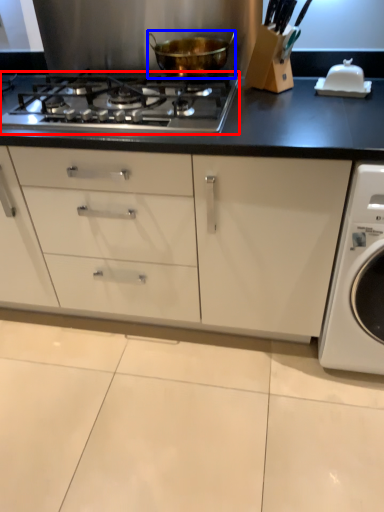
Question: Which object is closer to the camera taking this photo, gas stove (highlighted by a red box) or kitchen appliance (highlighted by a blue box)?

Choices:
 (A) gas stove
 (B) kitchen appliance

Answer: (A)